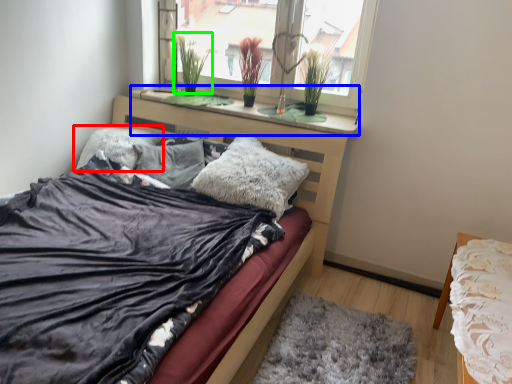
Question: Which is nearer to the pillow (highlighted by a red box)? window sill (highlighted by a blue box) or plant (highlighted by a green box).

Choices:
 (A) window sill
 (B) plant

Answer: (A)